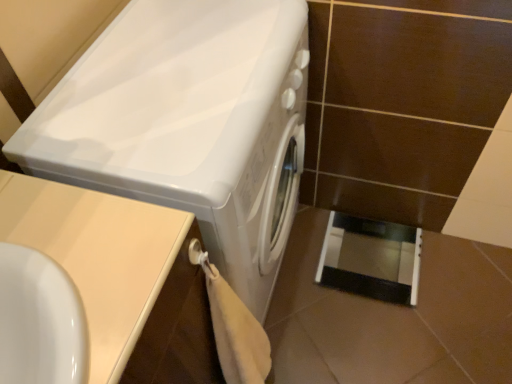
Question: From a real-world perspective, is white glossy washing machine at center on black glossy screen door at lower right?

Choices:
 (A) yes
 (B) no

Answer: (A)

Question: Is white glossy washing machine at center at the left side of black glossy screen door at lower right?

Choices:
 (A) yes
 (B) no

Answer: (A)

Question: Is white glossy washing machine at center bigger than black glossy screen door at lower right?

Choices:
 (A) yes
 (B) no

Answer: (A)

Question: Does white glossy washing machine at center have a lesser width compared to black glossy screen door at lower right?

Choices:
 (A) no
 (B) yes

Answer: (A)

Question: From the image's perspective, is white glossy washing machine at center below black glossy screen door at lower right?

Choices:
 (A) yes
 (B) no

Answer: (B)

Question: Considering the relative sizes of white glossy washing machine at center and black glossy screen door at lower right in the image provided, is white glossy washing machine at center shorter than black glossy screen door at lower right?

Choices:
 (A) yes
 (B) no

Answer: (B)

Question: Can you confirm if black glossy screen door at lower right is bigger than beige laminate counter top at lower left?

Choices:
 (A) yes
 (B) no

Answer: (B)

Question: Are black glossy screen door at lower right and beige laminate counter top at lower left making contact?

Choices:
 (A) no
 (B) yes

Answer: (A)

Question: Considering the relative sizes of black glossy screen door at lower right and beige laminate counter top at lower left in the image provided, is black glossy screen door at lower right taller than beige laminate counter top at lower left?

Choices:
 (A) yes
 (B) no

Answer: (B)

Question: Can you confirm if black glossy screen door at lower right is positioned to the left of beige laminate counter top at lower left?

Choices:
 (A) yes
 (B) no

Answer: (B)

Question: Is black glossy screen door at lower right at the right side of beige laminate counter top at lower left?

Choices:
 (A) yes
 (B) no

Answer: (A)

Question: Does black glossy screen door at lower right have a lesser height compared to beige laminate counter top at lower left?

Choices:
 (A) yes
 (B) no

Answer: (A)

Question: Does beige laminate counter top at lower left lie in front of black glossy screen door at lower right?

Choices:
 (A) no
 (B) yes

Answer: (B)